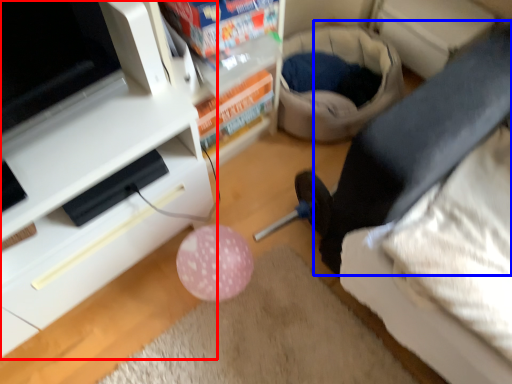
Question: Which of the following is the closest to the observer, furniture (highlighted by a red box) or leg (highlighted by a blue box)?

Choices:
 (A) furniture
 (B) leg

Answer: (A)